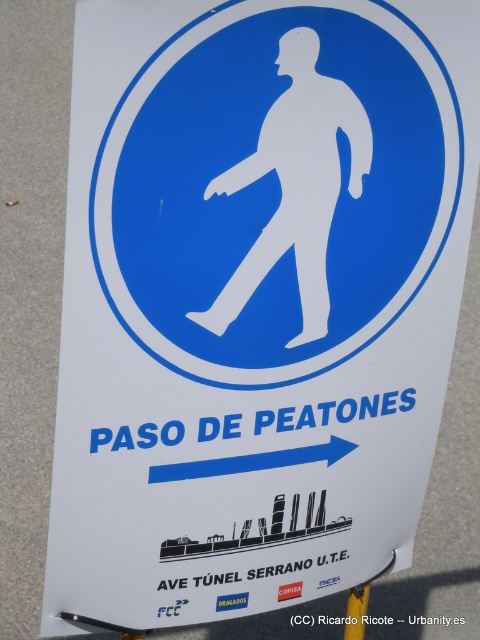
In the scene shown: Who is more distant from viewer, (x=251, y=168) or (x=364, y=586)?

The point (x=364, y=586) is behind.

Consider the image. Is white matte figure at center smaller than yellow plastic pole at lower center?

Actually, white matte figure at center might be larger than yellow plastic pole at lower center.

Does point (336, 108) come in front of point (360, 611)?

Yes, it is in front of point (360, 611).

This screenshot has width=480, height=640. Identify the location of white matte figure at center. (296, 184).